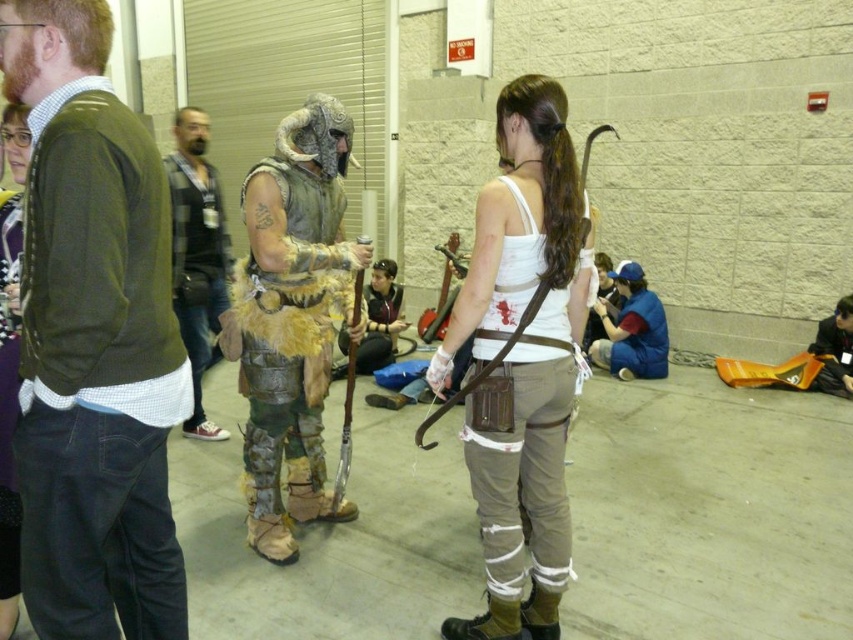
Which is behind, point (277, 392) or point (614, 362)?

The point (614, 362) is behind.

Is leather fur armor at center closer to camera compared to blue fabric shirt at lower right?

Yes, leather fur armor at center is in front of blue fabric shirt at lower right.

Find the location of a particular element. This screenshot has height=640, width=853. leather fur armor at center is located at coordinates (288, 321).

The height and width of the screenshot is (640, 853). In order to click on leather fur armor at center in this screenshot , I will do `click(288, 321)`.

Can you confirm if green sweater at center is thinner than white matte tank top at center?

Yes, green sweater at center is thinner than white matte tank top at center.

How far apart are green sweater at center and white matte tank top at center?

36.40 inches

Who is more forward, (184, 596) or (563, 509)?

Positioned in front is point (184, 596).

Where is `green sweater at center`? green sweater at center is located at coordinates (93, 340).

Looking at this image, does green sweater at center have a greater width compared to dark gray flannel shirt at left?

Yes.

Can you confirm if green sweater at center is thinner than dark gray flannel shirt at left?

Incorrect, green sweater at center's width is not less than dark gray flannel shirt at left's.

Identify the location of green sweater at center. (93, 340).

Locate an element on the screen. This screenshot has width=853, height=640. green sweater at center is located at coordinates (93, 340).